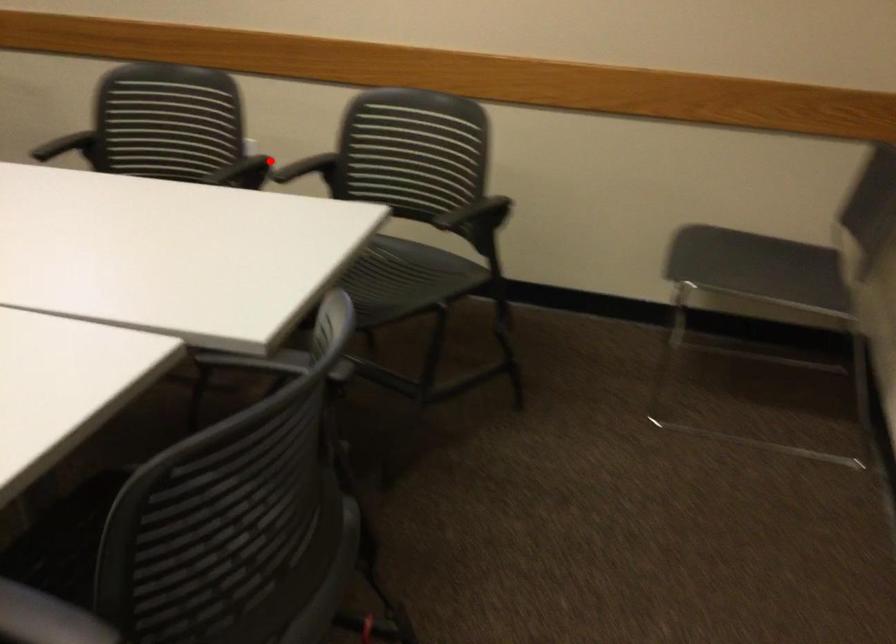
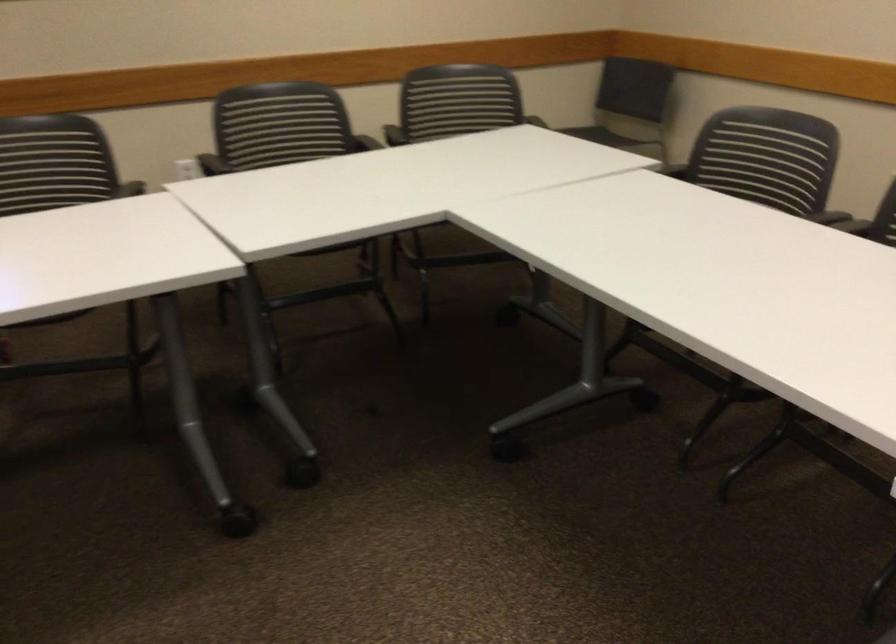
The point at the highlighted location is marked in the first image. Where is the corresponding point in the second image?

(360, 142)